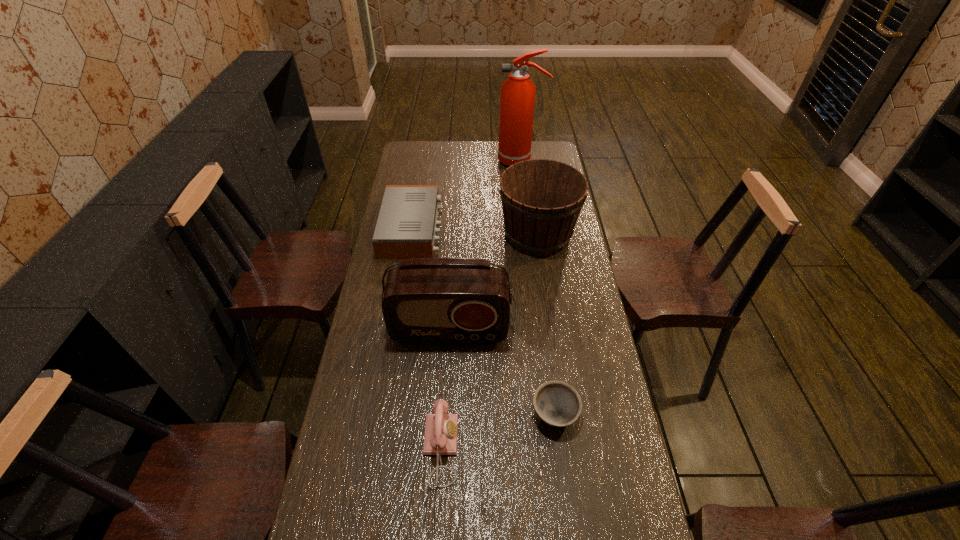
Locate an element on the screen. Image resolution: width=960 pixels, height=540 pixels. the farthest object is located at coordinates (517, 102).

Where is `fire extinguisher`? The height and width of the screenshot is (540, 960). fire extinguisher is located at coordinates (517, 102).

Locate an element on the screen. This screenshot has height=540, width=960. the fourth farthest object is located at coordinates (425, 300).

Where is `the taller radio receiver`? This screenshot has height=540, width=960. the taller radio receiver is located at coordinates (425, 300).

Locate an element on the screen. wine bucket is located at coordinates (541, 199).

This screenshot has height=540, width=960. I want to click on the third shortest object, so click(x=440, y=437).

The image size is (960, 540). I want to click on the shorter radio receiver, so click(406, 228).

You are a GUI agent. You are given a task and a screenshot of the screen. Output one action in this format:
    pyautogui.click(x=<x>, y=<y>)
    Task: Click on the farther radio receiver
    
    Given the screenshot: What is the action you would take?
    pyautogui.click(x=406, y=228)

Identify the location of the shortest object. The width and height of the screenshot is (960, 540). (558, 404).

Where is `vacant space located 0.250m at the nozzle of the farthest object`? Image resolution: width=960 pixels, height=540 pixels. vacant space located 0.250m at the nozzle of the farthest object is located at coordinates (446, 161).